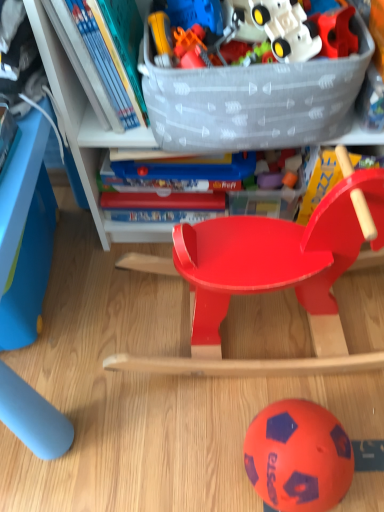
Question: Is translucent plastic storage box at upper center further to the viewer compared to glossy plastic rocking horse at center?

Choices:
 (A) yes
 (B) no

Answer: (A)

Question: Is translucent plastic storage box at upper center located outside glossy plastic rocking horse at center?

Choices:
 (A) no
 (B) yes

Answer: (B)

Question: Is translucent plastic storage box at upper center surrounding glossy plastic rocking horse at center?

Choices:
 (A) yes
 (B) no

Answer: (B)

Question: From a real-world perspective, is translucent plastic storage box at upper center on top of glossy plastic rocking horse at center?

Choices:
 (A) yes
 (B) no

Answer: (A)

Question: Does translucent plastic storage box at upper center have a lesser width compared to glossy plastic rocking horse at center?

Choices:
 (A) no
 (B) yes

Answer: (A)

Question: Do you think hardcover book at upper left is within translucent plastic storage box at upper center, or outside of it?

Choices:
 (A) inside
 (B) outside

Answer: (B)

Question: In terms of height, does hardcover book at upper left look taller or shorter compared to translucent plastic storage box at upper center?

Choices:
 (A) tall
 (B) short

Answer: (B)

Question: From the image's perspective, relative to translucent plastic storage box at upper center, is hardcover book at upper left above or below?

Choices:
 (A) below
 (B) above

Answer: (B)

Question: Does point (92, 38) appear closer or farther from the camera than point (226, 86)?

Choices:
 (A) closer
 (B) farther

Answer: (B)

Question: Is point (190, 314) positioned closer to the camera than point (102, 9)?

Choices:
 (A) closer
 (B) farther

Answer: (B)

Question: Relative to hardcover book at upper left, is glossy plastic rocking horse at center in front or behind?

Choices:
 (A) front
 (B) behind

Answer: (A)

Question: Is glossy plastic rocking horse at center bigger or smaller than hardcover book at upper left?

Choices:
 (A) small
 (B) big

Answer: (B)

Question: From a real-world perspective, is glossy plastic rocking horse at center above or below hardcover book at upper left?

Choices:
 (A) below
 (B) above

Answer: (A)

Question: From a real-world perspective, relative to orange rubber ball at lower center, is rubberized plastic puzzle piece at upper right vertically above or below?

Choices:
 (A) below
 (B) above

Answer: (B)

Question: In terms of size, does rubberized plastic puzzle piece at upper right appear bigger or smaller than orange rubber ball at lower center?

Choices:
 (A) small
 (B) big

Answer: (A)